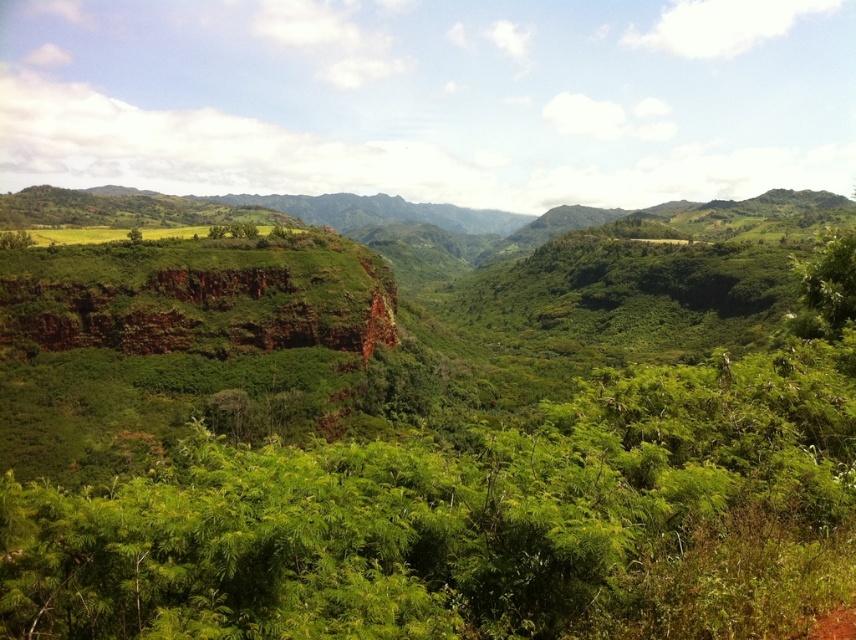
You are a hiker carrying a heavy backpack and need to reach the brown dirt track at lower right from your current position near the green leafy shrubs at center. Considering the rough terrain and your physical condition, do you think the 21.44 meters distance is manageable for you to walk?

The distance between the green leafy shrubs at center and the brown dirt track at lower right is 21.44 meters. Given the rough terrain described in the scene, this distance might be challenging but manageable for a hiker with a heavy backpack, provided they take necessary precautions and rest as needed.

You are planning a hiking route through the lush landscape. You need to decide whether to walk through the green leafy shrubs at center or take the brown dirt track at lower right. Which path has a wider passage for walking?

The green leafy shrubs at center has a larger width than the brown dirt track at lower right, so the green leafy shrubs at center would provide a wider passage for walking.